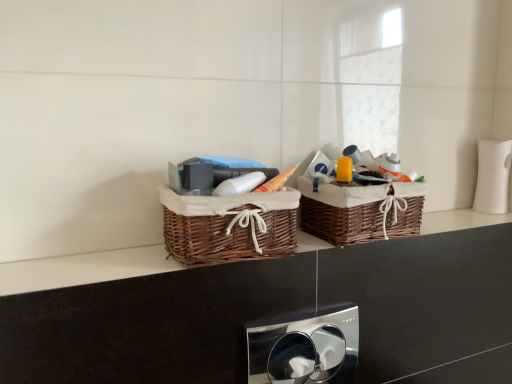
Image resolution: width=512 pixels, height=384 pixels. What do you see at coordinates (229, 226) in the screenshot? I see `woven brown basket at center, which appears as the 2th picnic basket when viewed from the right` at bounding box center [229, 226].

What do you see at coordinates (361, 211) in the screenshot? I see `woven brown basket at center, which is the 1th picnic basket in right-to-left order` at bounding box center [361, 211].

In order to face brown wicker baskets at center, should I rotate leftwards or rightwards?

To align with it, rotate right about 8.833°.

Describe the element at coordinates (305, 346) in the screenshot. This screenshot has width=512, height=384. I see `chrome metallic flush plate at center` at that location.

You are a GUI agent. You are given a task and a screenshot of the screen. Output one action in this format:
    pyautogui.click(x=<x>, y=<y>)
    Task: Click on the woven brown basket at center, which appears as the 2th picnic basket when viewed from the right
    This screenshot has height=384, width=512.
    Given the screenshot: What is the action you would take?
    pyautogui.click(x=229, y=226)

Could you tell me if chrome metallic flush plate at center is turned towards woven brown basket at center, which is the first picnic basket in left-to-right order?

No.

Considering the sizes of objects chrome metallic flush plate at center and woven brown basket at center, which appears as the 2th picnic basket when viewed from the right, in the image provided, who is taller, chrome metallic flush plate at center or woven brown basket at center, which appears as the 2th picnic basket when viewed from the right,?

Standing taller between the two is chrome metallic flush plate at center.

From a real-world perspective, is chrome metallic flush plate at center above or below woven brown basket at center, which appears as the 2th picnic basket when viewed from the right?

From a real-world perspective, chrome metallic flush plate at center is physically below woven brown basket at center, which appears as the 2th picnic basket when viewed from the right.

Is woven brown basket at center, which is the 1th picnic basket in right-to-left order, placed right next to chrome metallic flush plate at center?

No, woven brown basket at center, which is the 1th picnic basket in right-to-left order, is not next to chrome metallic flush plate at center.

Consider the image. In the image, is woven brown basket at center, which is the 2th picnic basket in left-to-right order, positioned in front of or behind chrome metallic flush plate at center?

Visually, woven brown basket at center, which is the 2th picnic basket in left-to-right order, is located behind chrome metallic flush plate at center.

Considering the positions of points (373, 230) and (339, 352), is point (373, 230) closer to camera compared to point (339, 352)?

Yes, point (373, 230) is in front of point (339, 352).

Where is `picnic basket behind the woven brown basket at center, which appears as the 2th picnic basket when viewed from the right`? picnic basket behind the woven brown basket at center, which appears as the 2th picnic basket when viewed from the right is located at coordinates (361, 211).

Is woven brown basket at center, which is the 1th picnic basket in right-to-left order, to the left of woven brown basket at center, which is the first picnic basket in left-to-right order, from the viewer's perspective?

In fact, woven brown basket at center, which is the 1th picnic basket in right-to-left order, is to the right of woven brown basket at center, which is the first picnic basket in left-to-right order.

Which object is closer to the camera taking this photo, woven brown basket at center, which is the 2th picnic basket in left-to-right order, or woven brown basket at center, which is the first picnic basket in left-to-right order?

woven brown basket at center, which is the first picnic basket in left-to-right order, is more forward.

Could woven brown basket at center, which appears as the 2th picnic basket when viewed from the right, be considered to be inside woven brown basket at center, which is the 1th picnic basket in right-to-left order?

Actually, woven brown basket at center, which appears as the 2th picnic basket when viewed from the right, is outside woven brown basket at center, which is the 1th picnic basket in right-to-left order.

Considering the sizes of woven brown basket at center, which appears as the 2th picnic basket when viewed from the right, and chrome metallic flush plate at center in the image, is woven brown basket at center, which appears as the 2th picnic basket when viewed from the right, bigger or smaller than chrome metallic flush plate at center?

woven brown basket at center, which appears as the 2th picnic basket when viewed from the right, is bigger than chrome metallic flush plate at center.

Visually, is woven brown basket at center, which is the first picnic basket in left-to-right order, positioned to the left or to the right of chrome metallic flush plate at center?

Based on their positions, woven brown basket at center, which is the first picnic basket in left-to-right order, is located to the left of chrome metallic flush plate at center.

Is woven brown basket at center, which is the first picnic basket in left-to-right order, in front of chrome metallic flush plate at center?

Yes, woven brown basket at center, which is the first picnic basket in left-to-right order, is closer to the viewer.

This screenshot has height=384, width=512. There is a brown wicker baskets at center. Identify the location of the 1st picnic basket above it (from a real-world perspective). (229, 226).

Does point (423, 286) appear closer or farther from the camera than point (267, 205)?

Point (423, 286) appears to be farther away from the viewer than point (267, 205).

Considering the sizes of objects brown wicker baskets at center and woven brown basket at center, which is the first picnic basket in left-to-right order, in the image provided, who is thinner, brown wicker baskets at center or woven brown basket at center, which is the first picnic basket in left-to-right order,?

With smaller width is brown wicker baskets at center.

From the image's perspective, which object appears higher, chrome metallic flush plate at center or brown wicker baskets at center?

brown wicker baskets at center appears higher in the image.

Considering the relative sizes of chrome metallic flush plate at center and brown wicker baskets at center in the image provided, is chrome metallic flush plate at center taller than brown wicker baskets at center?

Yes, chrome metallic flush plate at center is taller than brown wicker baskets at center.

Who is smaller, chrome metallic flush plate at center or brown wicker baskets at center?

brown wicker baskets at center is smaller.

Consider the image. Does woven brown basket at center, which appears as the 2th picnic basket when viewed from the right, appear on the left side of brown wicker baskets at center?

Indeed, woven brown basket at center, which appears as the 2th picnic basket when viewed from the right, is positioned on the left side of brown wicker baskets at center.

Is woven brown basket at center, which appears as the 2th picnic basket when viewed from the right, facing away from brown wicker baskets at center?

No, woven brown basket at center, which appears as the 2th picnic basket when viewed from the right,'s orientation is not away from brown wicker baskets at center.

How different are the orientations of woven brown basket at center, which is the first picnic basket in left-to-right order, and brown wicker baskets at center in degrees?

They differ by 0.078 degrees in their facing directions.

Is woven brown basket at center, which is the first picnic basket in left-to-right order, taller than brown wicker baskets at center?

Yes.

This screenshot has width=512, height=384. I want to click on appliance on the right of woven brown basket at center, which appears as the 2th picnic basket when viewed from the right, so click(x=305, y=346).

Locate an element on the screen. The width and height of the screenshot is (512, 384). picnic basket behind the chrome metallic flush plate at center is located at coordinates (361, 211).

Looking at the image, which one is located further to woven brown basket at center, which is the first picnic basket in left-to-right order, woven brown basket at center, which is the 1th picnic basket in right-to-left order, or brown wicker baskets at center?

brown wicker baskets at center is further to woven brown basket at center, which is the first picnic basket in left-to-right order.

In the scene shown: Looking at the image, which one is located further to woven brown basket at center, which is the 2th picnic basket in left-to-right order, brown wicker baskets at center or woven brown basket at center, which is the first picnic basket in left-to-right order?

woven brown basket at center, which is the first picnic basket in left-to-right order, is further to woven brown basket at center, which is the 2th picnic basket in left-to-right order.

Which object lies nearer to the anchor point chrome metallic flush plate at center, brown wicker baskets at center or woven brown basket at center, which appears as the 2th picnic basket when viewed from the right?

brown wicker baskets at center lies closer to chrome metallic flush plate at center than the other object.

Considering their positions, is woven brown basket at center, which is the 2th picnic basket in left-to-right order, positioned further to chrome metallic flush plate at center than brown wicker baskets at center?

woven brown basket at center, which is the 2th picnic basket in left-to-right order, lies further to chrome metallic flush plate at center than the other object.

In the scene shown: From the image, which object appears to be nearer to brown wicker baskets at center, woven brown basket at center, which appears as the 2th picnic basket when viewed from the right, or woven brown basket at center, which is the 1th picnic basket in right-to-left order?

woven brown basket at center, which is the 1th picnic basket in right-to-left order, is positioned closer to the anchor brown wicker baskets at center.

Looking at the image, which one is located closer to woven brown basket at center, which is the 2th picnic basket in left-to-right order, chrome metallic flush plate at center or woven brown basket at center, which is the first picnic basket in left-to-right order?

woven brown basket at center, which is the first picnic basket in left-to-right order, lies closer to woven brown basket at center, which is the 2th picnic basket in left-to-right order, than the other object.

When comparing their distances from woven brown basket at center, which is the 1th picnic basket in right-to-left order, does brown wicker baskets at center or chrome metallic flush plate at center seem further?

The object further to woven brown basket at center, which is the 1th picnic basket in right-to-left order, is chrome metallic flush plate at center.

Based on their spatial positions, is woven brown basket at center, which appears as the 2th picnic basket when viewed from the right, or chrome metallic flush plate at center further from brown wicker baskets at center?

chrome metallic flush plate at center is positioned further to the anchor brown wicker baskets at center.

Image resolution: width=512 pixels, height=384 pixels. I want to click on counter between woven brown basket at center, which is the 2th picnic basket in left-to-right order, and chrome metallic flush plate at center vertically, so click(268, 313).

Find the location of a particular element. This screenshot has height=384, width=512. counter between woven brown basket at center, which is the first picnic basket in left-to-right order, and woven brown basket at center, which is the 2th picnic basket in left-to-right order, in the horizontal direction is located at coordinates (268, 313).

I want to click on counter between woven brown basket at center, which is the first picnic basket in left-to-right order, and chrome metallic flush plate at center in the up-down direction, so click(268, 313).

This screenshot has width=512, height=384. Find the location of `picnic basket between woven brown basket at center, which is the 2th picnic basket in left-to-right order, and chrome metallic flush plate at center vertically`. picnic basket between woven brown basket at center, which is the 2th picnic basket in left-to-right order, and chrome metallic flush plate at center vertically is located at coordinates (229, 226).